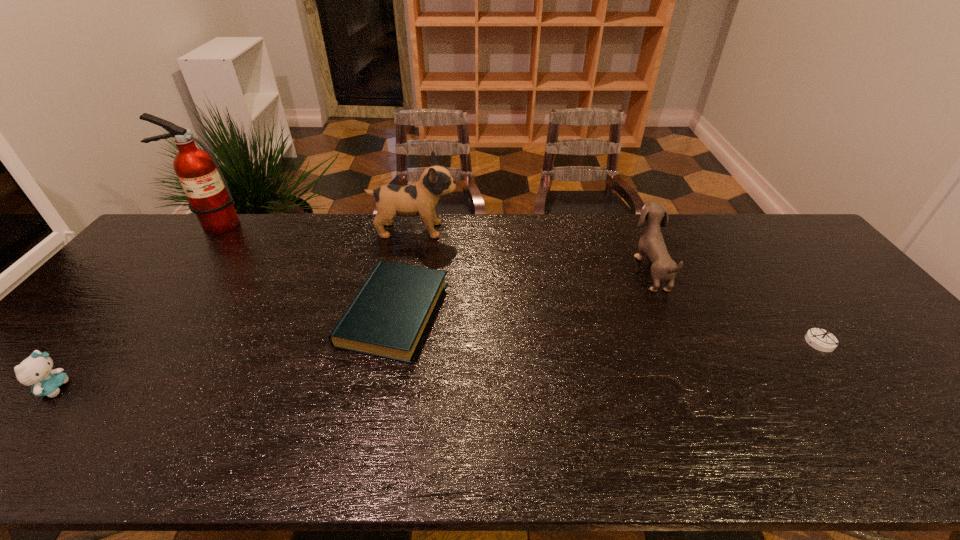
At what (x,y) coordinates should I click in order to perform the action: click on object situated at the far left corner. Please return your answer as a coordinate pair (x, y). Image resolution: width=960 pixels, height=540 pixels. Looking at the image, I should click on (209, 197).

You are a GUI agent. You are given a task and a screenshot of the screen. Output one action in this format:
    pyautogui.click(x=<x>, y=<y>)
    Task: Click on the vacant space at the far edge of the desktop
    
    Given the screenshot: What is the action you would take?
    pyautogui.click(x=735, y=225)

Locate an element on the screen. The height and width of the screenshot is (540, 960). vacant region at the near edge of the desktop is located at coordinates (808, 438).

At what (x,y) coordinates should I click in order to perform the action: click on vacant space at the right edge. Please return your answer as a coordinate pair (x, y). Image resolution: width=960 pixels, height=540 pixels. Looking at the image, I should click on (893, 341).

In the image, there is a desktop. Where is `vacant space at the near left corner`? The height and width of the screenshot is (540, 960). vacant space at the near left corner is located at coordinates (8, 440).

Locate an element on the screen. This screenshot has height=540, width=960. blank area at the far right corner is located at coordinates (757, 238).

Locate an element on the screen. The width and height of the screenshot is (960, 540). unoccupied position between the compass and the shorter puppy is located at coordinates (735, 306).

The width and height of the screenshot is (960, 540). What are the coordinates of `free space between the fire extinguisher and the taller puppy` in the screenshot? It's located at (314, 227).

The width and height of the screenshot is (960, 540). Identify the location of vacant region between the rightmost object and the nearest object. (437, 365).

Locate an element on the screen. This screenshot has height=540, width=960. vacant space in between the compass and the book is located at coordinates (608, 328).